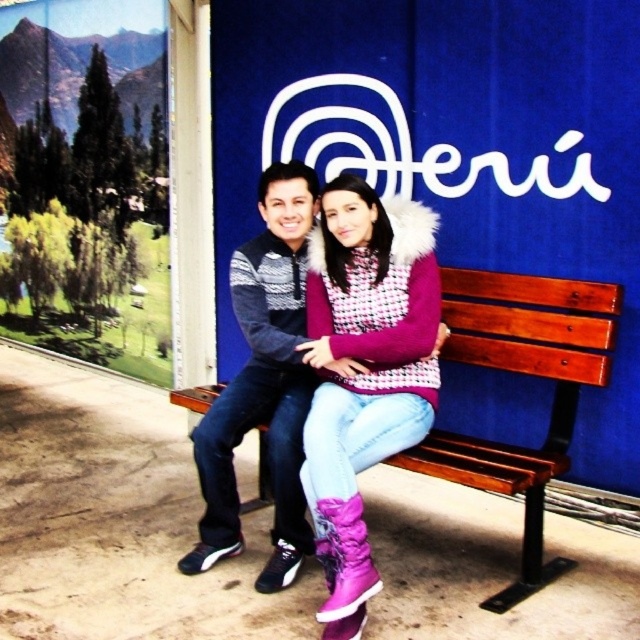
Who is higher up, blue fabric peru sign at center or dark gray knit sweater at center?

blue fabric peru sign at center

Does blue fabric peru sign at center appear over dark gray knit sweater at center?

Indeed, blue fabric peru sign at center is positioned over dark gray knit sweater at center.

Is point (472, 6) less distant than point (288, 547)?

No, it is behind (288, 547).

Where is `blue fabric peru sign at center`? blue fabric peru sign at center is located at coordinates (456, 147).

The height and width of the screenshot is (640, 640). I want to click on purple suede boots at center, so click(x=364, y=369).

What do you see at coordinates (364, 369) in the screenshot? I see `purple suede boots at center` at bounding box center [364, 369].

Locate an element on the screen. This screenshot has height=640, width=640. purple suede boots at center is located at coordinates (364, 369).

You are a GUI agent. You are given a task and a screenshot of the screen. Output one action in this format:
    pyautogui.click(x=<x>, y=<y>)
    Task: Click on the purple suede boots at center
    The width and height of the screenshot is (640, 640).
    Given the screenshot: What is the action you would take?
    pyautogui.click(x=364, y=369)

What do you see at coordinates (525, 374) in the screenshot? I see `wooden bench at center` at bounding box center [525, 374].

Does point (468, 305) come farther from viewer compared to point (284, 282)?

Yes.

Where is `wooden bench at center`? wooden bench at center is located at coordinates (525, 374).